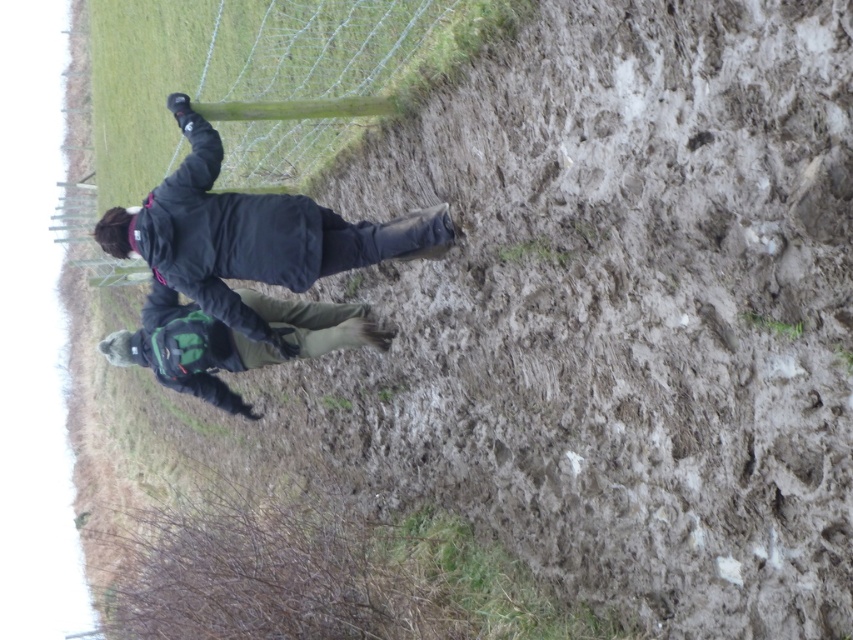
Question: Can you confirm if dark gray fabric jacket at center is positioned below dark green fabric jacket at center?

Choices:
 (A) no
 (B) yes

Answer: (A)

Question: Which object is closer to the camera taking this photo?

Choices:
 (A) dark green fabric jacket at center
 (B) dark gray fabric jacket at center

Answer: (B)

Question: Among these points, which one is nearest to the camera?

Choices:
 (A) (299, 268)
 (B) (310, 337)

Answer: (A)

Question: Where is dark gray fabric jacket at center located in relation to dark green fabric jacket at center in the image?

Choices:
 (A) left
 (B) right

Answer: (B)

Question: Does dark gray fabric jacket at center appear under dark green fabric jacket at center?

Choices:
 (A) yes
 (B) no

Answer: (B)